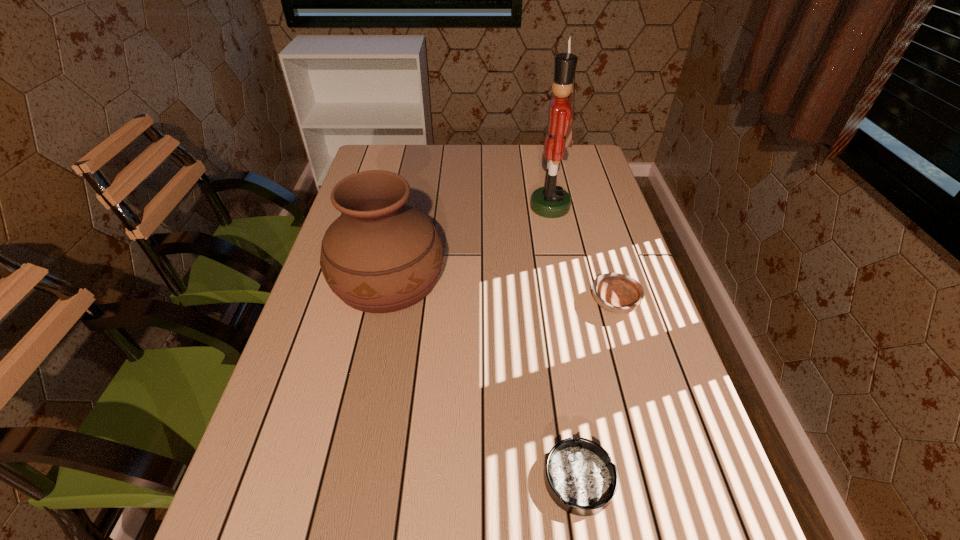
The width and height of the screenshot is (960, 540). I want to click on free space located on the back of the leftmost object, so click(x=407, y=190).

The image size is (960, 540). Identify the location of free location located 0.200m on the back of the bowl. (594, 237).

Find the location of a particular element. free space located on the left of the ashtray is located at coordinates (458, 480).

This screenshot has height=540, width=960. Find the location of `object situated at the left edge`. object situated at the left edge is located at coordinates (380, 255).

Locate an element on the screen. The width and height of the screenshot is (960, 540). nutcracker located in the right edge section of the desktop is located at coordinates (551, 201).

In order to click on bowl that is at the right edge in this screenshot , I will do `click(617, 293)`.

You are a GUI agent. You are given a task and a screenshot of the screen. Output one action in this format:
    pyautogui.click(x=<x>, y=<y>)
    Task: Click on the free space at the far edge of the desktop
    
    Given the screenshot: What is the action you would take?
    pyautogui.click(x=470, y=151)

Image resolution: width=960 pixels, height=540 pixels. In the image, there is a desktop. Find the location of `vacant space at the left edge`. vacant space at the left edge is located at coordinates (322, 517).

The width and height of the screenshot is (960, 540). Find the location of `free space at the right edge of the desktop`. free space at the right edge of the desktop is located at coordinates (601, 214).

Locate an element on the screen. vacant region between the second tallest object and the ashtray is located at coordinates (483, 380).